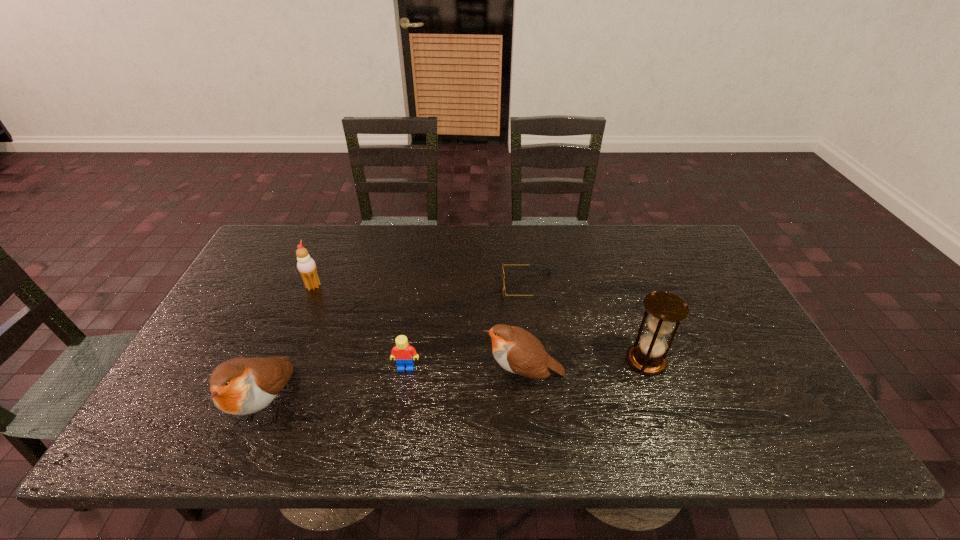
At what (x,y) coordinates should I click in order to perform the action: click on vacant space at the far right corner of the desktop. Please return your answer as a coordinate pair (x, y). Looking at the image, I should click on (690, 240).

Where is `vacant point located between the hourglass and the icecream`? The width and height of the screenshot is (960, 540). vacant point located between the hourglass and the icecream is located at coordinates tap(480, 323).

This screenshot has width=960, height=540. In order to click on free space between the fourth object from right to left and the icecream in this screenshot , I will do `click(360, 327)`.

You are a GUI agent. You are given a task and a screenshot of the screen. Output one action in this format:
    pyautogui.click(x=<x>, y=<y>)
    Task: Click on the unoccupied position between the taller bird and the shorter bird
    This screenshot has height=540, width=960.
    Given the screenshot: What is the action you would take?
    pyautogui.click(x=396, y=389)

The image size is (960, 540). What are the coordinates of `empty space that is in between the hourglass and the shorter bird` in the screenshot? It's located at (585, 368).

This screenshot has height=540, width=960. In order to click on free spot between the icecream and the right bird in this screenshot , I will do `click(419, 330)`.

In order to click on empty location between the fourth object from right to left and the taller bird in this screenshot , I will do `click(337, 386)`.

Find the location of `vacant region between the fifth tallest object and the left bird`. vacant region between the fifth tallest object and the left bird is located at coordinates (337, 386).

You are a GUI agent. You are given a task and a screenshot of the screen. Output one action in this format:
    pyautogui.click(x=<x>, y=<y>)
    Task: Click on the vacant space that's between the icecream and the rightmost object
    
    Given the screenshot: What is the action you would take?
    pyautogui.click(x=480, y=323)

Identify which object is the fourth closest to the taller bird. Please provide its 2D coordinates. Your answer should be formatted as a tuple, i.e. [(x, y)], where the tuple contains the x and y coordinates of a point satisfying the conditions above.

[(503, 275)]